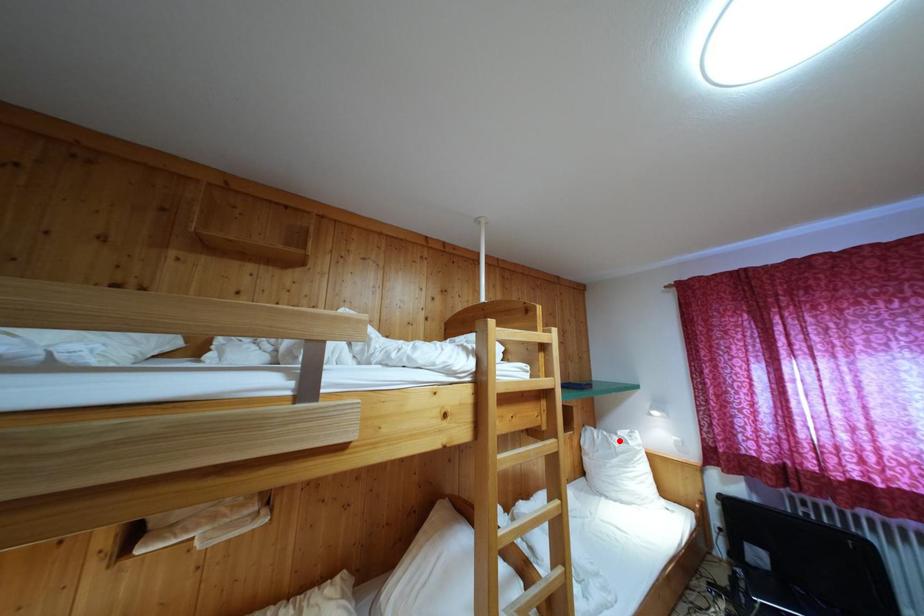
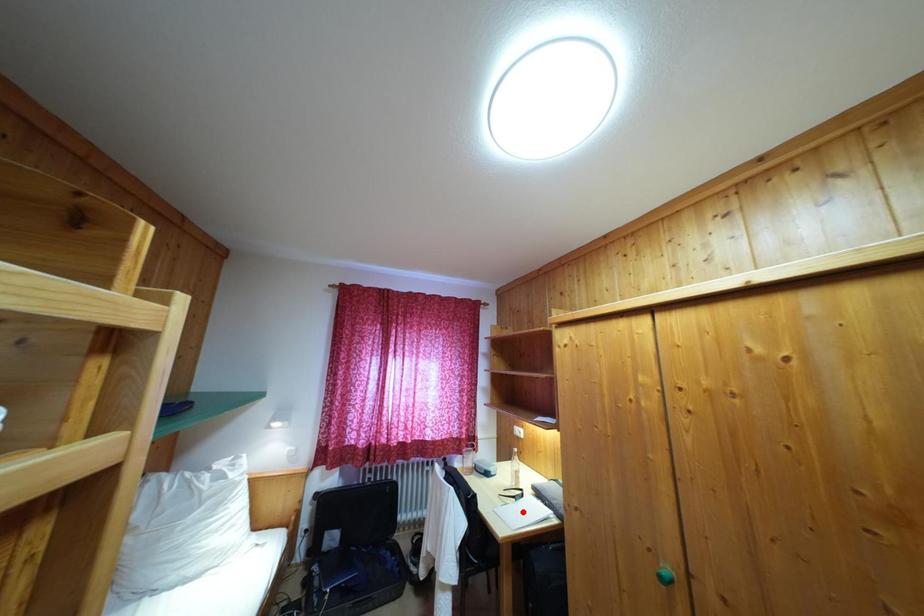
I am providing you with two images of the same scene from different viewpoints. A red point is marked on the first image and another point is marked on the second image. Does the point marked in image1 correspond to the same location as the one in image2?

No